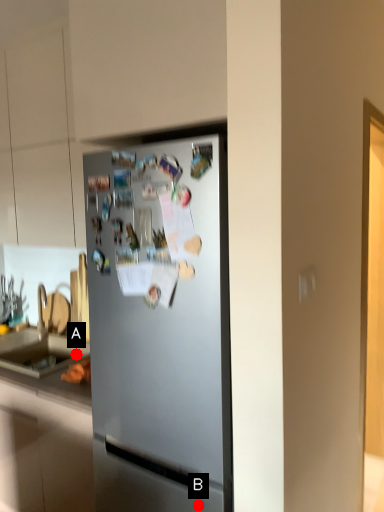
Question: Two points are circled on the image, labeled by A and B beside each circle. Which point appears closest to the camera in this image?

Choices:
 (A) A is closer
 (B) B is closer

Answer: (B)